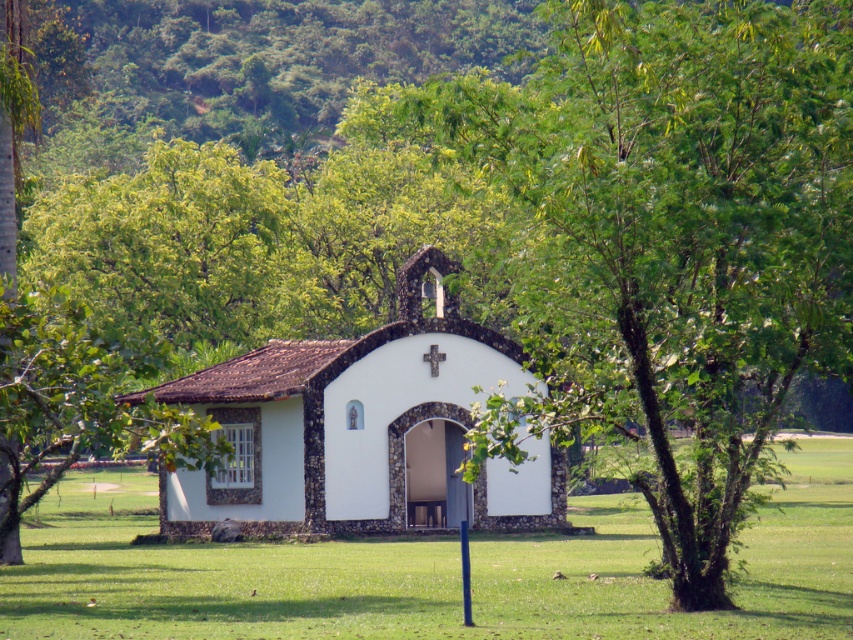
You are standing in front of the chapel and notice the green leafy tree at center and the green grass at center. Which object is positioned higher relative to the other?

The green leafy tree at center is above green grass at center, so the tree is positioned higher than the grass.

You are standing at the entrance of the white chapel and see two points marked on the ground. The first point is at coordinate point (x=158, y=632) and the second is at point (x=306, y=486). If you want to walk towards the point that is closer to you, which coordinate should you head towards?

You should head towards point (x=158, y=632) because it is in front of point (x=306, y=486), meaning it is closer to your current position at the entrance.

You are standing in front of the chapel and want to take a photo of both the green leafy tree at center and the green grass at center. Which object will appear larger in the photo?

The green leafy tree at center will appear larger in the photo because it is much taller than the green grass at center.